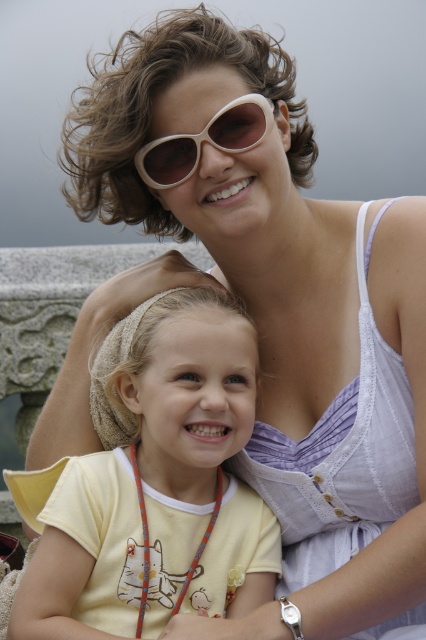
You are a photographer trying to capture a candid shot of the yellow cotton shirt at center and the beige plastic sunglasses at upper center. Which object should you focus on first if you want to include both in your frame without moving the camera?

The yellow cotton shirt at center is much taller than the beige plastic sunglasses at upper center, so you should focus on the yellow cotton shirt at center first to ensure it fits within the frame.

You are standing at the position of point (x=250, y=145) and want to move towards the direction where point (x=245, y=552) is located. According to the scene, will you be moving forward or backward relative to your current position?

Point (x=245, y=552) is in front of point (x=250, y=145), so moving towards it would mean moving forward relative to your current position.